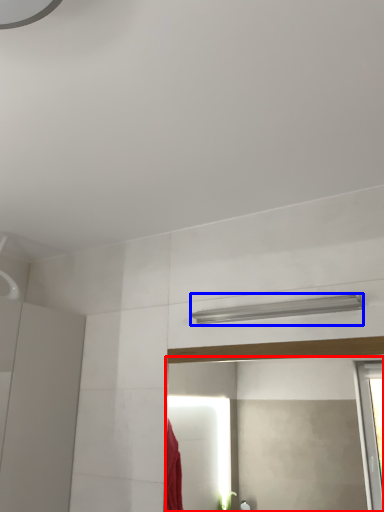
Question: Among these objects, which one is nearest to the camera, mirror (highlighted by a red box) or shower (highlighted by a blue box)?

Choices:
 (A) mirror
 (B) shower

Answer: (A)